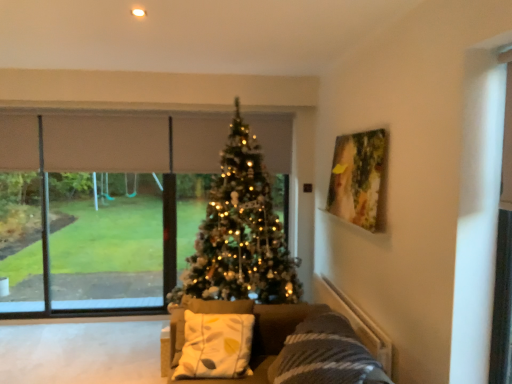
Question: Can you confirm if iridescent gold christmas tree at center is taller than transparent glass window at center?

Choices:
 (A) yes
 (B) no

Answer: (A)

Question: Considering the relative sizes of iridescent gold christmas tree at center and transparent glass window at center in the image provided, is iridescent gold christmas tree at center bigger than transparent glass window at center?

Choices:
 (A) no
 (B) yes

Answer: (B)

Question: From the image's perspective, is iridescent gold christmas tree at center below transparent glass window at center?

Choices:
 (A) no
 (B) yes

Answer: (A)

Question: From a real-world perspective, is iridescent gold christmas tree at center below transparent glass window at center?

Choices:
 (A) yes
 (B) no

Answer: (B)

Question: Would you consider iridescent gold christmas tree at center to be distant from transparent glass window at center?

Choices:
 (A) no
 (B) yes

Answer: (B)

Question: From the image's perspective, is velvet grey couch at center located above or below white fabric pillow at center?

Choices:
 (A) above
 (B) below

Answer: (B)

Question: Looking at their shapes, would you say velvet grey couch at center is wider or thinner than white fabric pillow at center?

Choices:
 (A) thin
 (B) wide

Answer: (B)

Question: From a real-world perspective, is velvet grey couch at center above or below white fabric pillow at center?

Choices:
 (A) below
 (B) above

Answer: (A)

Question: Considering their positions, is velvet grey couch at center located in front of or behind white fabric pillow at center?

Choices:
 (A) behind
 (B) front

Answer: (B)

Question: In the image, is velvet grey couch at center positioned in front of or behind transparent glass screen door at right?

Choices:
 (A) front
 (B) behind

Answer: (A)

Question: Is velvet grey couch at center to the left or to the right of transparent glass screen door at right in the image?

Choices:
 (A) left
 (B) right

Answer: (A)

Question: In terms of height, does velvet grey couch at center look taller or shorter compared to transparent glass screen door at right?

Choices:
 (A) short
 (B) tall

Answer: (A)

Question: Looking at the image, does velvet grey couch at center seem bigger or smaller compared to transparent glass screen door at right?

Choices:
 (A) big
 (B) small

Answer: (A)

Question: In terms of width, does wooden painting at upper right look wider or thinner when compared to transparent glass screen door at right?

Choices:
 (A) wide
 (B) thin

Answer: (A)

Question: Considering the relative positions of wooden painting at upper right and transparent glass screen door at right in the image provided, is wooden painting at upper right to the left or to the right of transparent glass screen door at right?

Choices:
 (A) right
 (B) left

Answer: (B)